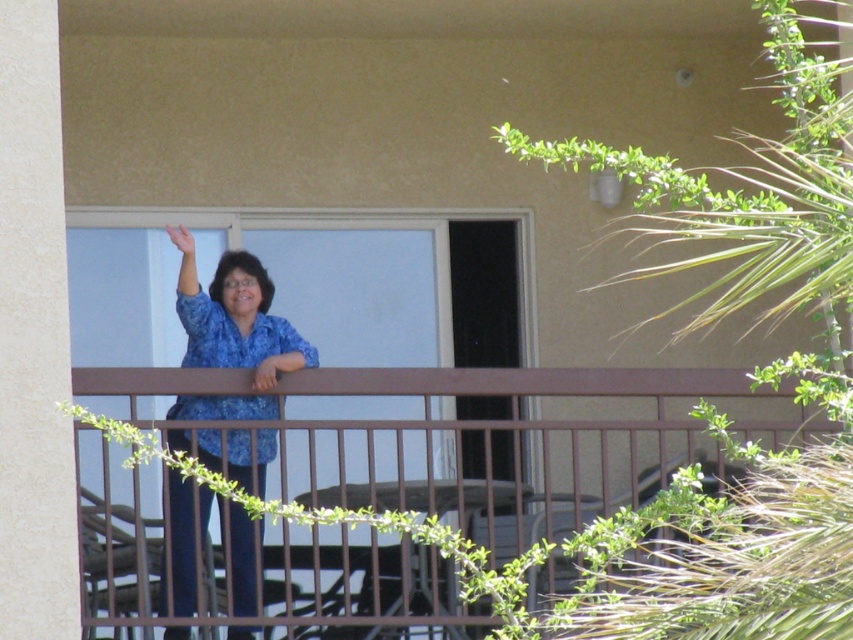
Does blue printed blouse at center have a lesser width compared to matte skin hand at upper center?

No.

Can you confirm if blue printed blouse at center is shorter than matte skin hand at upper center?

No.

Between point (184, 513) and point (189, 237), which one is positioned in front?

Point (189, 237) is more forward.

You are a GUI agent. You are given a task and a screenshot of the screen. Output one action in this format:
    pyautogui.click(x=<x>, y=<y>)
    Task: Click on the blue printed blouse at center
    Image resolution: width=853 pixels, height=640 pixels.
    Given the screenshot: What is the action you would take?
    pyautogui.click(x=235, y=317)

Is blue printed blouse at center bigger than matte blue shirt at upper left?

Yes.

Does point (169, 444) come closer to viewer compared to point (190, 332)?

That is True.

Image resolution: width=853 pixels, height=640 pixels. In order to click on blue printed blouse at center in this screenshot , I will do `click(235, 317)`.

Identify the location of blue printed blouse at center. (235, 317).

Is brown metal railing at upper center shorter than matte blue shirt at upper left?

Correct, brown metal railing at upper center is not as tall as matte blue shirt at upper left.

Is brown metal railing at upper center below matte blue shirt at upper left?

Yes.

Is point (331, 381) positioned behind point (184, 308)?

No, (331, 381) is closer to viewer.

Locate an element on the screen. Image resolution: width=853 pixels, height=640 pixels. brown metal railing at upper center is located at coordinates (550, 512).